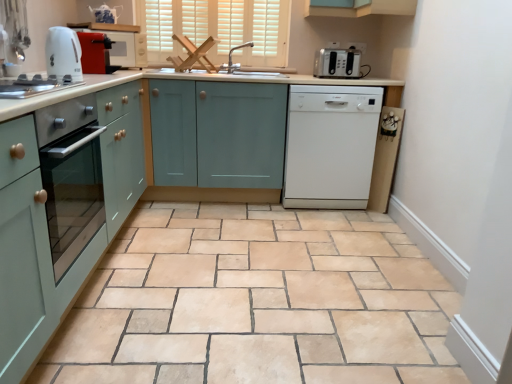
Question: From the image's perspective, relative to matte teal cabinet at left, acting as the 1th cabinetry starting from the left, is white glossy electric kettle at upper left, which appears as the first home appliance when viewed from the front, above or below?

Choices:
 (A) below
 (B) above

Answer: (B)

Question: Considering the positions of white glossy electric kettle at upper left, the 1th home appliance in the left-to-right sequence, and matte teal cabinet at left, which is counted as the second cabinetry, starting from the right, in the image, is white glossy electric kettle at upper left, the 1th home appliance in the left-to-right sequence, taller or shorter than matte teal cabinet at left, which is counted as the second cabinetry, starting from the right,?

Choices:
 (A) short
 (B) tall

Answer: (A)

Question: Which of these objects is positioned closest to the white glossy countertop at center?

Choices:
 (A) matte red toaster at upper left, which is the 2th kitchen appliance from top to bottom
 (B) natural stone floor at center
 (C) white glossy electric kettle at left, placed as the first kitchen appliance when sorted from front to back
 (D) matte glass oven at left
 (E) teal matte cabinet at center, which is the 1th cabinetry in right-to-left order

Answer: (D)

Question: Which is nearer to the white glossy countertop at center?

Choices:
 (A) white matte window at upper center
 (B) matte glass oven at left
 (C) silver metallic faucet at center
 (D) matte teal cabinet at left, which is counted as the second cabinetry, starting from the right
 (E) white glossy electric kettle at upper left, marked as the 2th home appliance in a right-to-left arrangement

Answer: (D)